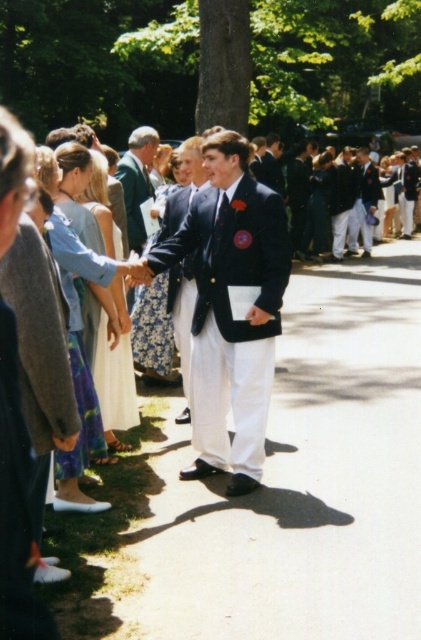
You are attending a formal event and notice two items at the center of the scene. Which one is bigger between the white satin dress at center and the green wool blazer at center?

The white satin dress at center is larger in size than the green wool blazer at center.

You are a photographer at the event and need to ensure both the white satin dress at center and the dark blue blazer at center are visible in the photo. Which one should you focus on to make sure the other is also in the frame?

The white satin dress at center is in front of the dark blue blazer at center. Therefore, focusing on the white satin dress at center will ensure the dark blue blazer at center is also visible behind it.